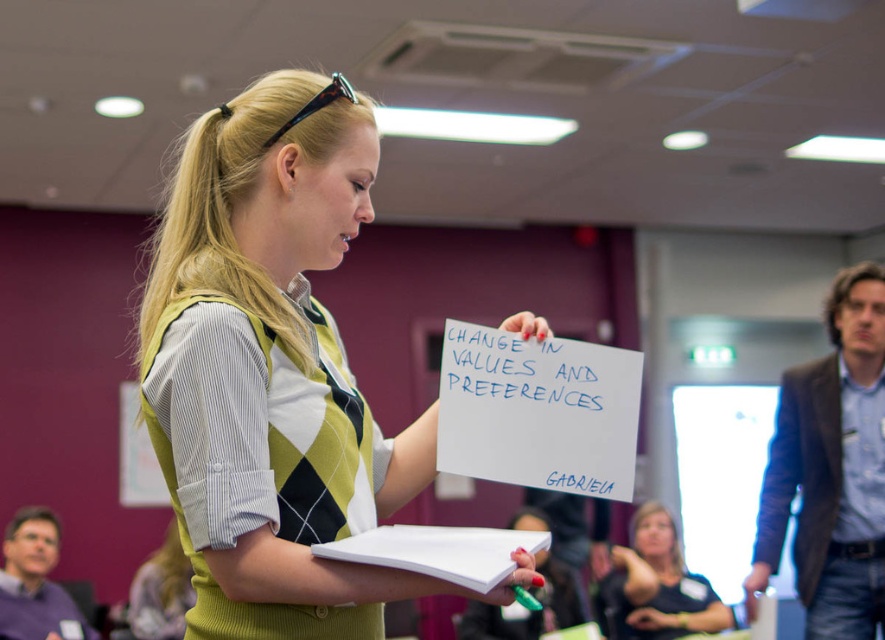
Between green argyle sweater vest at center and blonde hair at center, which one is positioned lower?

blonde hair at center is below.

Does point (325, 192) lie in front of point (645, 602)?

Yes, it is in front of point (645, 602).

Who is more distant from viewer, [350,512] or [614,550]?

Positioned behind is point [614,550].

Locate an element on the screen. This screenshot has height=640, width=885. green argyle sweater vest at center is located at coordinates coord(273,371).

Which is more to the right, green argyle sweater vest at center or blue marker writing at center?

blue marker writing at center is more to the right.

Does green argyle sweater vest at center come in front of blue marker writing at center?

Yes, it is.

This screenshot has width=885, height=640. What are the coordinates of `green argyle sweater vest at center` in the screenshot? It's located at (273, 371).

Can you confirm if blue marker writing at center is shorter than blonde hair at center?

Yes.

Can you confirm if blue marker writing at center is positioned below blonde hair at center?

No.

Is point (560, 417) farther from viewer compared to point (612, 608)?

That is False.

Find the location of a particular element. This screenshot has width=885, height=640. blue marker writing at center is located at coordinates (529, 378).